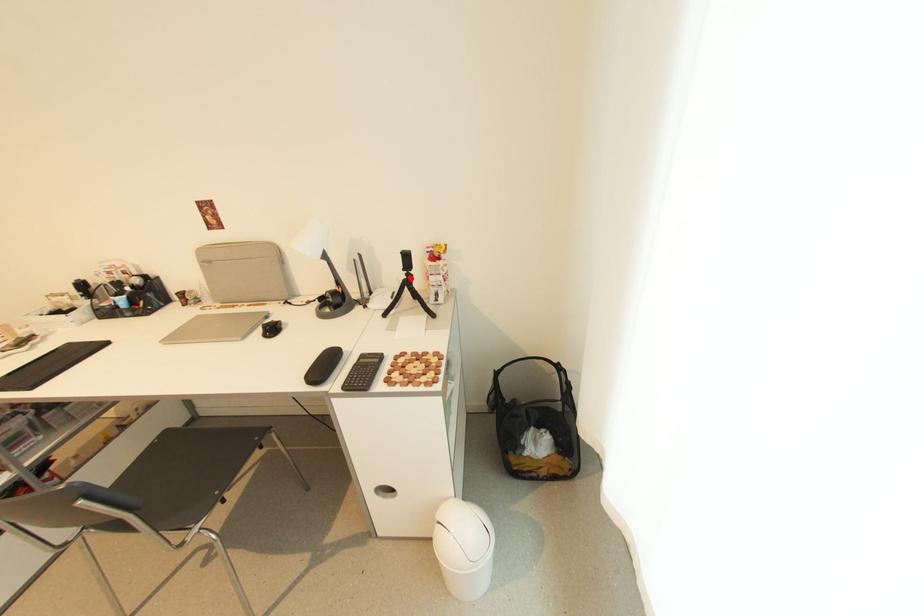
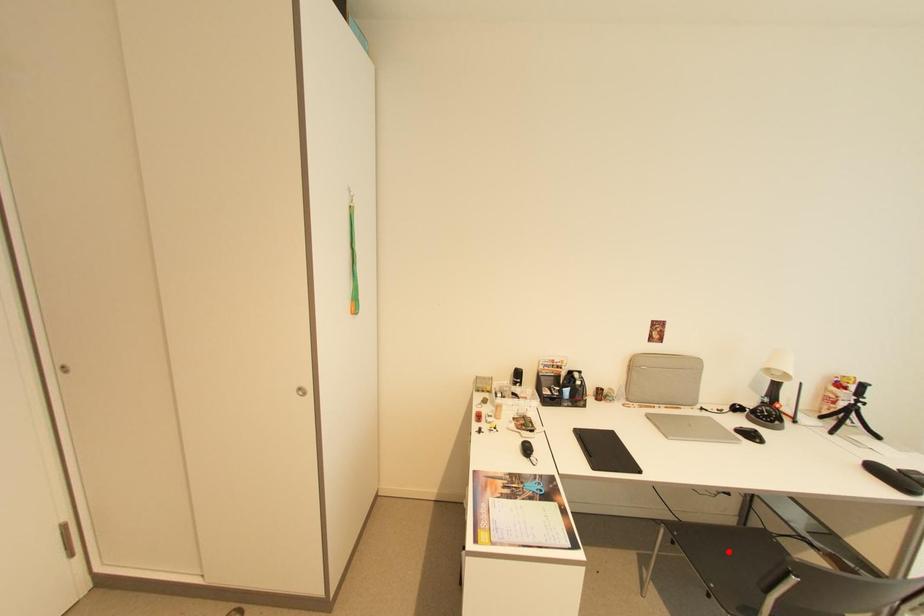
I am providing you with two images of the same scene from different viewpoints. A red point is marked on the first image and another point is marked on the second image. Is the red point in image1 aligned with the point shown in image2?

No